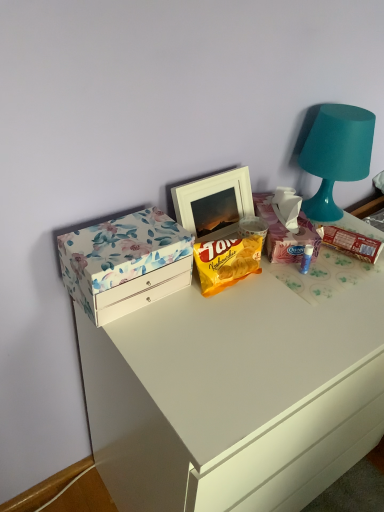
At what (x,y) coordinates should I click in order to perform the action: click on free space in front of matte white picture frame at center. Please return your answer as a coordinate pair (x, y). This screenshot has height=512, width=384. Looking at the image, I should click on (244, 300).